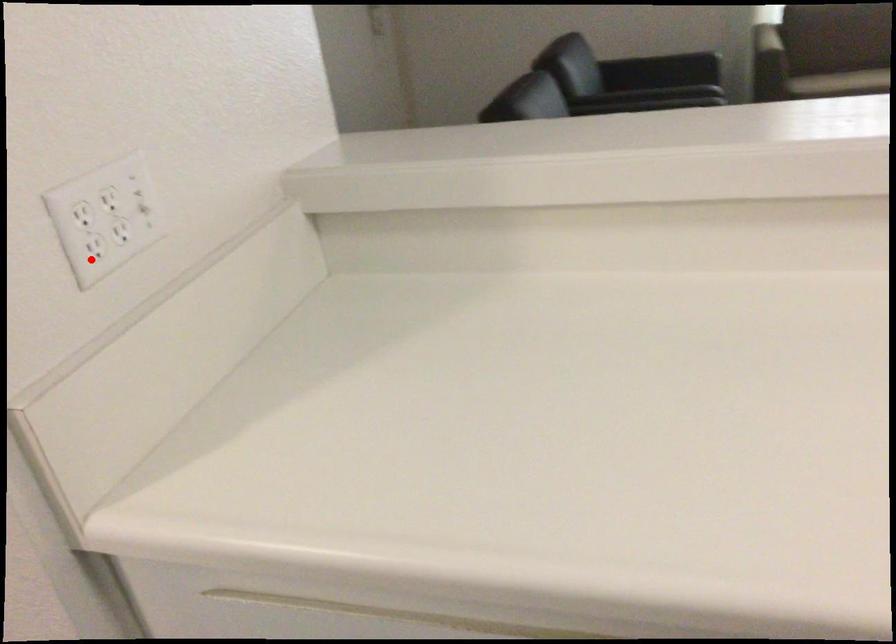
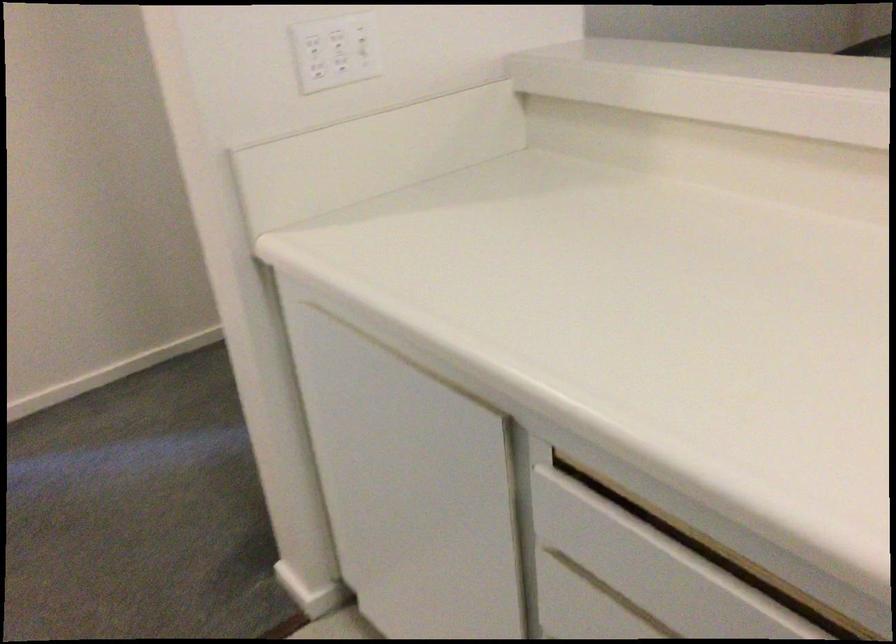
Question: I am providing you with two images of the same scene from different viewpoints. A red point is shown in image1. For the corresponding object point in image2, is it positioned nearer or farther from the camera?

Choices:
 (A) Nearer
 (B) Farther

Answer: (B)